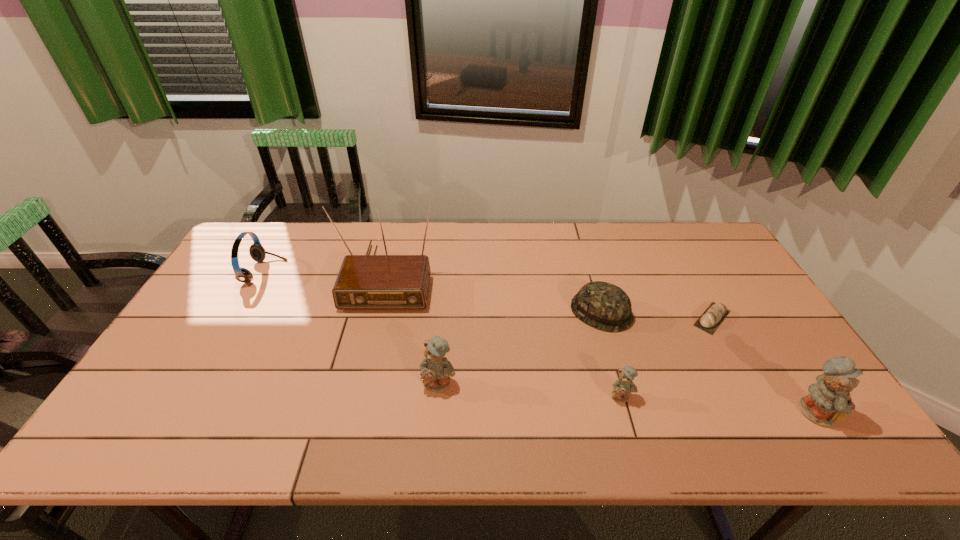
The width and height of the screenshot is (960, 540). I want to click on free point that keeps the teddy bears evenly spaced on the left, so click(x=267, y=369).